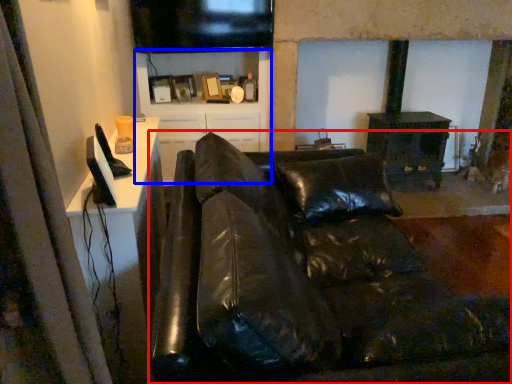
Question: Which object is closer to the camera taking this photo, studio couch (highlighted by a red box) or tv cabinet (highlighted by a blue box)?

Choices:
 (A) studio couch
 (B) tv cabinet

Answer: (A)